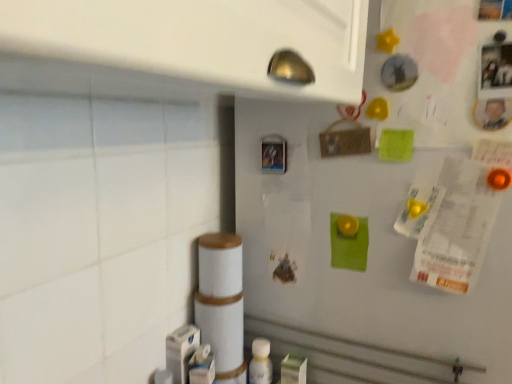
Question: Is white plastic bottle at lower center wider than metallic plastic button at center?

Choices:
 (A) yes
 (B) no

Answer: (A)

Question: Is white plastic bottle at lower center touching metallic plastic button at center?

Choices:
 (A) yes
 (B) no

Answer: (B)

Question: Does white plastic bottle at lower center turn towards metallic plastic button at center?

Choices:
 (A) yes
 (B) no

Answer: (B)

Question: Can you confirm if white plastic bottle at lower center is shorter than metallic plastic button at center?

Choices:
 (A) yes
 (B) no

Answer: (B)

Question: From the image's perspective, would you say white plastic bottle at lower center is shown under metallic plastic button at center?

Choices:
 (A) yes
 (B) no

Answer: (A)

Question: Relative to white matte refrigerator at upper right, is white plastic bottle at lower center in front or behind?

Choices:
 (A) front
 (B) behind

Answer: (B)

Question: Choose the correct answer: Is white plastic bottle at lower center inside white matte refrigerator at upper right or outside it?

Choices:
 (A) inside
 (B) outside

Answer: (B)

Question: Looking at their shapes, would you say white plastic bottle at lower center is wider or thinner than white matte refrigerator at upper right?

Choices:
 (A) wide
 (B) thin

Answer: (B)

Question: Is point (264, 364) positioned closer to the camera than point (355, 380)?

Choices:
 (A) farther
 (B) closer

Answer: (A)

Question: Is white matte refrigerator at upper right wider or thinner than white plastic bottle at lower center?

Choices:
 (A) thin
 (B) wide

Answer: (B)

Question: Does point click(492, 284) appear closer or farther from the camera than point click(262, 349)?

Choices:
 (A) farther
 (B) closer

Answer: (B)

Question: Based on their sizes in the image, would you say white matte refrigerator at upper right is bigger or smaller than white plastic bottle at lower center?

Choices:
 (A) small
 (B) big

Answer: (B)

Question: Is white matte refrigerator at upper right in front of or behind white plastic bottle at lower center in the image?

Choices:
 (A) front
 (B) behind

Answer: (A)

Question: Considering the positions of metallic plastic button at center and white matte refrigerator at upper right in the image, is metallic plastic button at center bigger or smaller than white matte refrigerator at upper right?

Choices:
 (A) big
 (B) small

Answer: (B)

Question: From their relative heights in the image, would you say metallic plastic button at center is taller or shorter than white matte refrigerator at upper right?

Choices:
 (A) tall
 (B) short

Answer: (B)